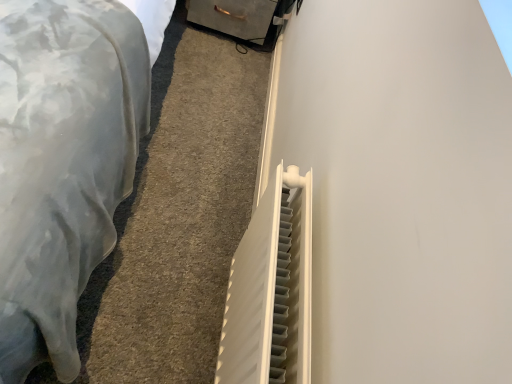
The image size is (512, 384). Find the location of `vacant space behind white plastic radiator at center-right`. vacant space behind white plastic radiator at center-right is located at coordinates (205, 240).